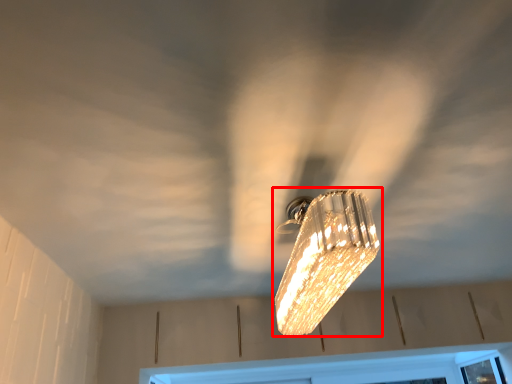
Question: Where is lamp (annotated by the red box) located in relation to window frame in the image?

Choices:
 (A) left
 (B) right

Answer: (A)